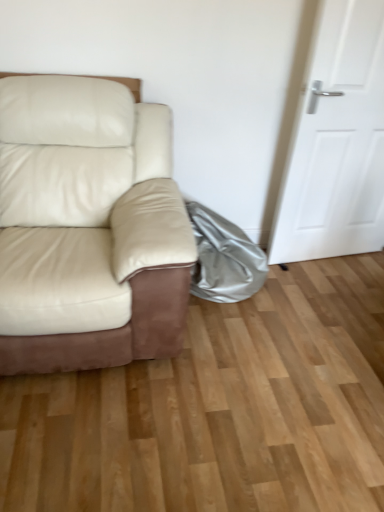
Question: From the image's perspective, is shiny metallic bag at lower right located above or below white matte door at right?

Choices:
 (A) above
 (B) below

Answer: (B)

Question: Considering the positions of shiny metallic bag at lower right and white matte door at right in the image, is shiny metallic bag at lower right taller or shorter than white matte door at right?

Choices:
 (A) short
 (B) tall

Answer: (A)

Question: Which is nearer to the matte cream leather couch at left?

Choices:
 (A) shiny metallic bag at lower right
 (B) white matte door at right

Answer: (A)

Question: Based on their relative distances, which object is nearer to the matte cream leather couch at left?

Choices:
 (A) white matte door at right
 (B) shiny metallic bag at lower right

Answer: (B)